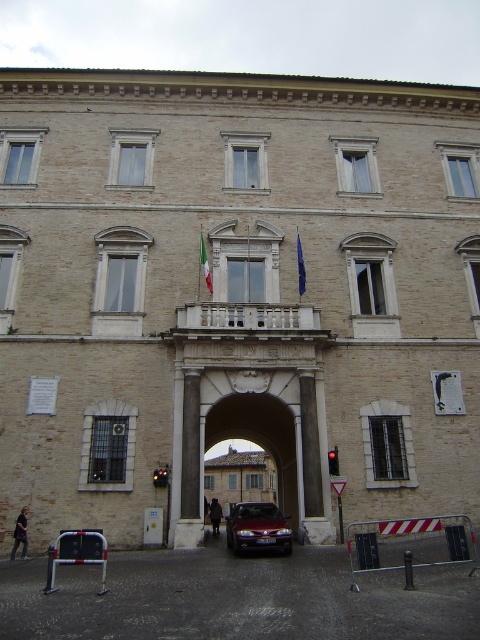
Who is shorter, denim jacket at lower left or dark brown leather coat at center?

denim jacket at lower left

Between point (24, 554) and point (218, 502), which one is positioned behind?

Point (218, 502)

Identify the location of denim jacket at lower left. The width and height of the screenshot is (480, 640). (21, 534).

Between smooth stone archway at center and satin silver sedan at center, which one appears on the left side from the viewer's perspective?

From the viewer's perspective, satin silver sedan at center appears more on the left side.

This screenshot has height=640, width=480. Describe the element at coordinates (261, 438) in the screenshot. I see `smooth stone archway at center` at that location.

You are a GUI agent. You are given a task and a screenshot of the screen. Output one action in this format:
    pyautogui.click(x=<x>, y=<y>)
    Task: Click on the smooth stone archway at center
    This screenshot has width=480, height=640.
    Given the screenshot: What is the action you would take?
    pyautogui.click(x=261, y=438)

Who is lower down, green fabric flag at center or dark brown leather coat at center?

Positioned lower is dark brown leather coat at center.

Is the position of green fabric flag at center less distant than that of dark brown leather coat at center?

Yes, green fabric flag at center is closer to the viewer.

Is point (207, 260) positioned after point (217, 504)?

No, it is in front of (217, 504).

Find the location of a particular element. This screenshot has height=640, width=480. green fabric flag at center is located at coordinates (204, 264).